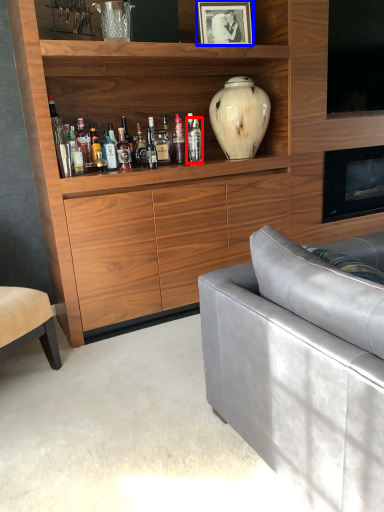
Question: Which object is closer to the camera taking this photo, bottle (highlighted by a red box) or picture frame (highlighted by a blue box)?

Choices:
 (A) bottle
 (B) picture frame

Answer: (B)